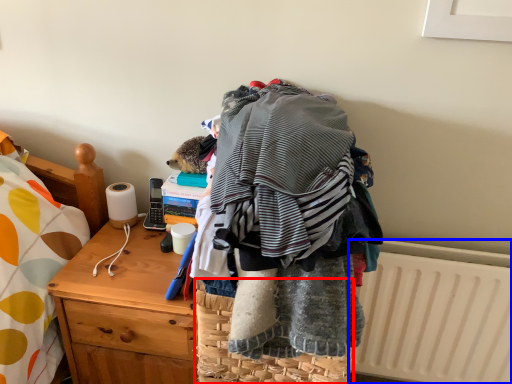
Question: Which object appears closest to the camera in this image, picnic basket (highlighted by a red box) or radiator (highlighted by a blue box)?

Choices:
 (A) picnic basket
 (B) radiator

Answer: (A)